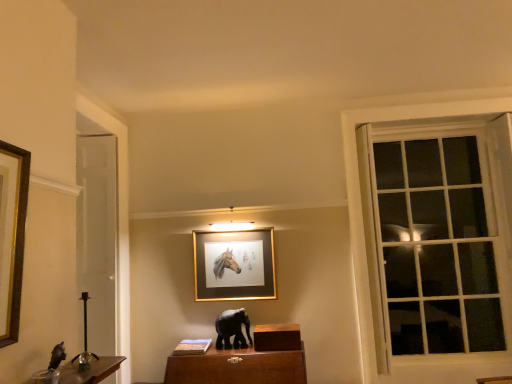
Describe the element at coordinates (57, 356) in the screenshot. I see `shiny black elephant at left, the 1th animal from the front` at that location.

The width and height of the screenshot is (512, 384). I want to click on white glass window at right, so click(x=436, y=238).

You are a GUI agent. You are given a task and a screenshot of the screen. Output one action in this format:
    pyautogui.click(x=<x>, y=<y>)
    Task: Click on the shiny black elephant at left, the 2th animal ordered from the bottom
    The height and width of the screenshot is (384, 512).
    Given the screenshot: What is the action you would take?
    pyautogui.click(x=57, y=356)

Can you tell me how much shiny black elephant at left, the 1th animal from the front, and black glossy elephant at center, acting as the 1th animal starting from the bottom, differ in facing direction?

They differ by 31.5 degrees in their facing directions.

Which is behind, point (57, 365) or point (226, 345)?

Point (226, 345)

Between shiny black elephant at left, the 1th animal from the front, and black glossy elephant at center, acting as the 1th animal starting from the bottom, which one has larger size?

With larger size is black glossy elephant at center, acting as the 1th animal starting from the bottom.

Is black glossy elephant at center, placed as the second animal when sorted from left to right, beside white glass window at right?

No.

From the image's perspective, would you say black glossy elephant at center, the second animal positioned from the top, is shown under white glass window at right?

Yes, from the image's perspective, black glossy elephant at center, the second animal positioned from the top, is beneath white glass window at right.

From a real-world perspective, is black glossy elephant at center, the second animal positioned from the top, physically below white glass window at right?

Correct, in the physical world, black glossy elephant at center, the second animal positioned from the top, is lower than white glass window at right.

Based on the photo, what's the angular difference between black glossy elephant at center, acting as the 1th animal starting from the bottom, and white glass window at right's facing directions?

They differ by 0.252 degrees in their facing directions.

Is white glass window at right far away from gold/metallic picture frame at center?

Yes.

Considering the positions of objects white glass window at right and gold/metallic picture frame at center in the image provided, who is in front, white glass window at right or gold/metallic picture frame at center?

white glass window at right is more forward.

What's the angular difference between white glass window at right and gold/metallic picture frame at center's facing directions?

0.189 degrees separate the facing orientations of white glass window at right and gold/metallic picture frame at center.

Is white glass window at right turned away from gold/metallic picture frame at center?

No.

Does white glass window at right have a larger size compared to black glossy elephant at center, acting as the 1th animal starting from the bottom?

Correct, white glass window at right is larger in size than black glossy elephant at center, acting as the 1th animal starting from the bottom.

From the image's perspective, is white glass window at right located above or below black glossy elephant at center, which is the 2th animal from front to back?

white glass window at right is situated higher than black glossy elephant at center, which is the 2th animal from front to back, in the image.

Considering the relative positions of white glass window at right and black glossy elephant at center, the first animal when ordered from back to front, in the image provided, is white glass window at right to the right of black glossy elephant at center, the first animal when ordered from back to front, from the viewer's perspective?

Indeed, white glass window at right is positioned on the right side of black glossy elephant at center, the first animal when ordered from back to front.

From a real-world perspective, which is physically above, white glass window at right or black glossy elephant at center, placed as the second animal when sorted from left to right?

white glass window at right, from a real-world perspective.

Is gold/metallic picture frame at center not near shiny black elephant at left, the 1th animal in the top-to-bottom sequence?

Indeed, gold/metallic picture frame at center is not near shiny black elephant at left, the 1th animal in the top-to-bottom sequence.

The width and height of the screenshot is (512, 384). I want to click on animal that is the 1st one when counting downward from the gold/metallic picture frame at center (from the image's perspective), so click(57, 356).

Does gold/metallic picture frame at center contain shiny black elephant at left, the 1th animal in the top-to-bottom sequence?

No, shiny black elephant at left, the 1th animal in the top-to-bottom sequence, is located outside of gold/metallic picture frame at center.

Considering the relative sizes of gold/metallic picture frame at center and shiny black elephant at left, the 1th animal in the top-to-bottom sequence, in the image provided, is gold/metallic picture frame at center wider than shiny black elephant at left, the 1th animal in the top-to-bottom sequence,?

Incorrect, the width of gold/metallic picture frame at center does not surpass that of shiny black elephant at left, the 1th animal in the top-to-bottom sequence.

Is shiny black elephant at left, the first animal from the left, facing towards white glass window at right?

No, shiny black elephant at left, the first animal from the left, is not oriented towards white glass window at right.

From the image's perspective, between shiny black elephant at left, the 1th animal in the top-to-bottom sequence, and white glass window at right, who is located below?

shiny black elephant at left, the 1th animal in the top-to-bottom sequence, from the image's perspective.

Is the position of shiny black elephant at left, the 1th animal from the front, less distant than that of white glass window at right?

Yes, it is.

Can we say shiny black elephant at left, the 2th animal when ordered from right to left, lies outside white glass window at right?

Yes.

What's the angular difference between white glass window at right and shiny black elephant at left, the 1th animal in the top-to-bottom sequence,'s facing directions?

The facing directions of white glass window at right and shiny black elephant at left, the 1th animal in the top-to-bottom sequence, are 31.3 degrees apart.

Is point (441, 266) closer or farther from the camera than point (64, 358)?

Point (441, 266).

Is white glass window at right wider than shiny black elephant at left, positioned as the 2th animal in back-to-front order?

No.

Identify the location of animal in front of the white glass window at right. This screenshot has height=384, width=512. (57, 356).

The image size is (512, 384). What are the coordinates of `animal lying on the right of shiny black elephant at left, positioned as the 2th animal in back-to-front order` in the screenshot? It's located at (232, 329).

At what (x,y) coordinates should I click in order to perform the action: click on window in front of the black glossy elephant at center, placed as the second animal when sorted from left to right. Please return your answer as a coordinate pair (x, y). The height and width of the screenshot is (384, 512). Looking at the image, I should click on (436, 238).

From the image, which object appears to be nearer to white glass window at right, shiny black elephant at left, the 2th animal when ordered from right to left, or black glossy elephant at center, which is the 2th animal from front to back?

black glossy elephant at center, which is the 2th animal from front to back.

From the image, which object appears to be farther from gold/metallic picture frame at center, black glossy elephant at center, the first animal when ordered from back to front, or shiny black elephant at left, the 1th animal from the front?

shiny black elephant at left, the 1th animal from the front, lies further to gold/metallic picture frame at center than the other object.

When comparing their distances from white glass window at right, does gold/metallic picture frame at center or shiny black elephant at left, the first animal from the left, seem closer?

Based on the image, gold/metallic picture frame at center appears to be nearer to white glass window at right.

Based on their spatial positions, is gold/metallic picture frame at center or shiny black elephant at left, the first animal from the left, further from black glossy elephant at center, arranged as the first animal when viewed from the right?

Based on the image, shiny black elephant at left, the first animal from the left, appears to be further to black glossy elephant at center, arranged as the first animal when viewed from the right.

Looking at the image, which one is located closer to shiny black elephant at left, the 1th animal in the top-to-bottom sequence, black glossy elephant at center, placed as the second animal when sorted from left to right, or white glass window at right?

black glossy elephant at center, placed as the second animal when sorted from left to right, is closer to shiny black elephant at left, the 1th animal in the top-to-bottom sequence.

Considering their positions, is gold/metallic picture frame at center positioned closer to shiny black elephant at left, the 1th animal from the front, than black glossy elephant at center, which is the 2th animal from front to back?

Among the two, black glossy elephant at center, which is the 2th animal from front to back, is located nearer to shiny black elephant at left, the 1th animal from the front.

From the image, which object appears to be farther from white glass window at right, black glossy elephant at center, placed as the second animal when sorted from left to right, or gold/metallic picture frame at center?

black glossy elephant at center, placed as the second animal when sorted from left to right, is further to white glass window at right.

Looking at the image, which one is located further to black glossy elephant at center, placed as the second animal when sorted from left to right, white glass window at right or gold/metallic picture frame at center?

white glass window at right is positioned further to the anchor black glossy elephant at center, placed as the second animal when sorted from left to right.

This screenshot has width=512, height=384. Find the location of `picture frame between shiny black elephant at left, positioned as the 2th animal in back-to-front order, and white glass window at right`. picture frame between shiny black elephant at left, positioned as the 2th animal in back-to-front order, and white glass window at right is located at coordinates (234, 265).

Find the location of a particular element. The width and height of the screenshot is (512, 384). animal located between gold/metallic picture frame at center and white glass window at right in the left-right direction is located at coordinates (232, 329).

Find the location of `animal situated between shiny black elephant at left, the 2th animal when ordered from right to left, and white glass window at right from left to right`. animal situated between shiny black elephant at left, the 2th animal when ordered from right to left, and white glass window at right from left to right is located at coordinates (232, 329).

Identify the location of animal between shiny black elephant at left, the first animal from the left, and gold/metallic picture frame at center, along the z-axis. This screenshot has width=512, height=384. (232, 329).